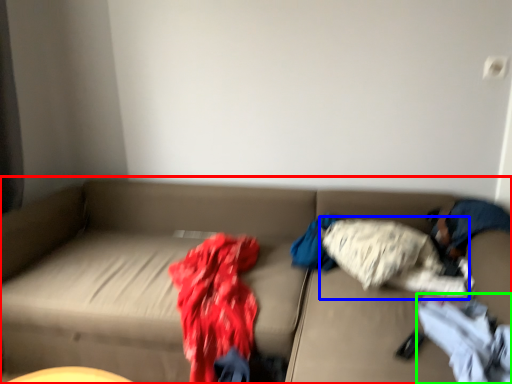
Question: Estimate the real-world distances between objects in this image. Which object is farther from studio couch (highlighted by a red box), clothing (highlighted by a blue box) or clothing (highlighted by a green box)?

Choices:
 (A) clothing
 (B) clothing

Answer: (B)